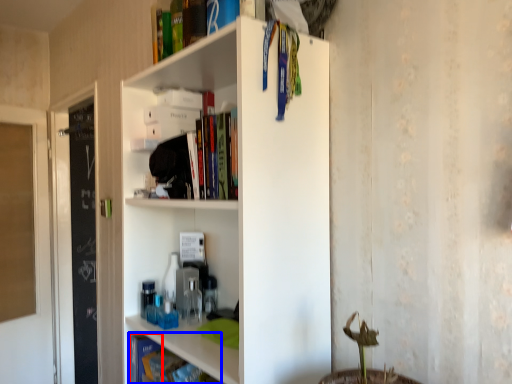
Question: Among these objects, which one is farthest to the camera, book (highlighted by a red box) or book (highlighted by a blue box)?

Choices:
 (A) book
 (B) book

Answer: (A)